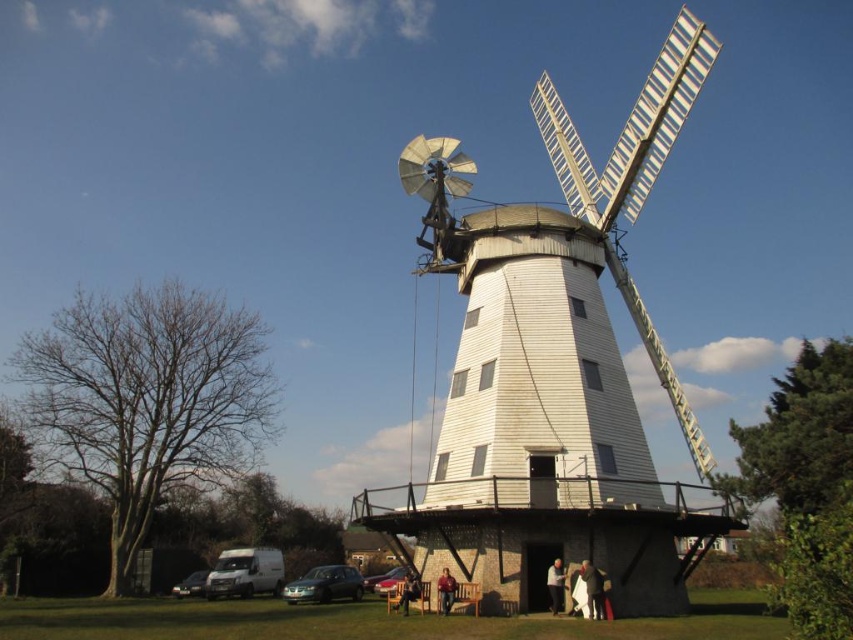
Can you confirm if metallic silver car at center is bigger than dark brown leather chair at lower center?

Indeed, metallic silver car at center has a larger size compared to dark brown leather chair at lower center.

Does metallic silver car at center appear on the left side of dark brown leather chair at lower center?

Indeed, metallic silver car at center is positioned on the left side of dark brown leather chair at lower center.

At what (x,y) coordinates should I click in order to perform the action: click on metallic silver car at center. Please return your answer as a coordinate pair (x, y). This screenshot has height=640, width=853. Looking at the image, I should click on (393, 580).

Does light brown wooden chair at lower center come in front of metallic silver car at lower left?

Yes, light brown wooden chair at lower center is closer to the viewer.

Is light brown wooden chair at lower center above metallic silver car at lower left?

Correct, light brown wooden chair at lower center is located above metallic silver car at lower left.

I want to click on light brown wooden chair at lower center, so click(555, 586).

Does point (482, 387) come closer to viewer compared to point (547, 577)?

No, it is not.

Describe the element at coordinates (553, 369) in the screenshot. I see `white wooden windmill at center` at that location.

I want to click on white wooden windmill at center, so point(553,369).